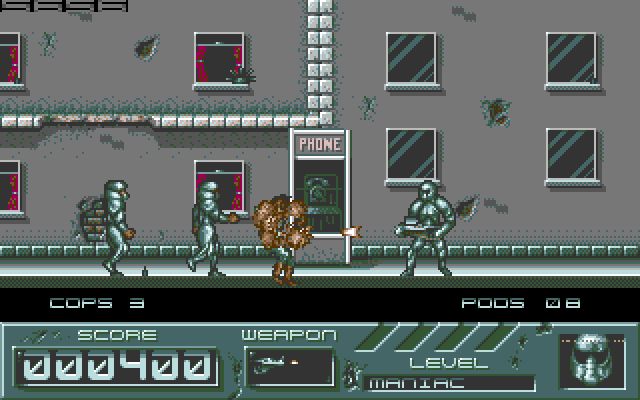
The width and height of the screenshot is (640, 400). I want to click on windows, so click(576, 146), click(404, 152), click(397, 52), click(564, 70), click(219, 65), click(221, 186), click(9, 198), click(8, 75).